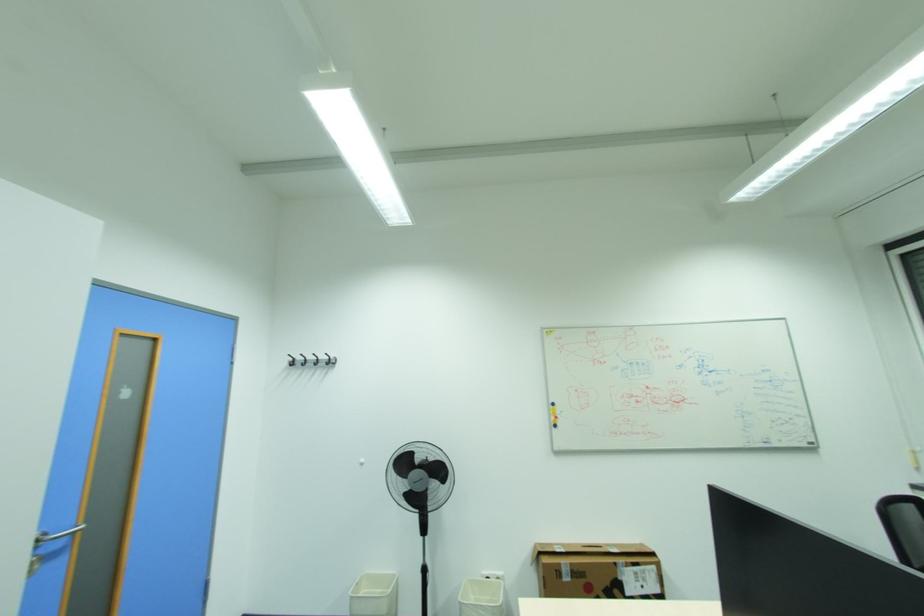
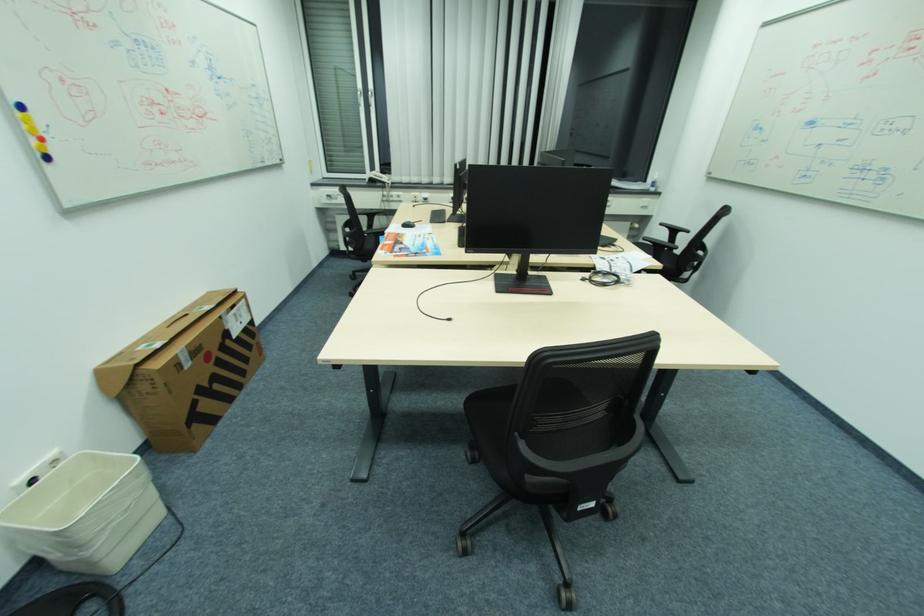
Find the pixel in the second image that matches [565,564] in the first image.

(181, 355)